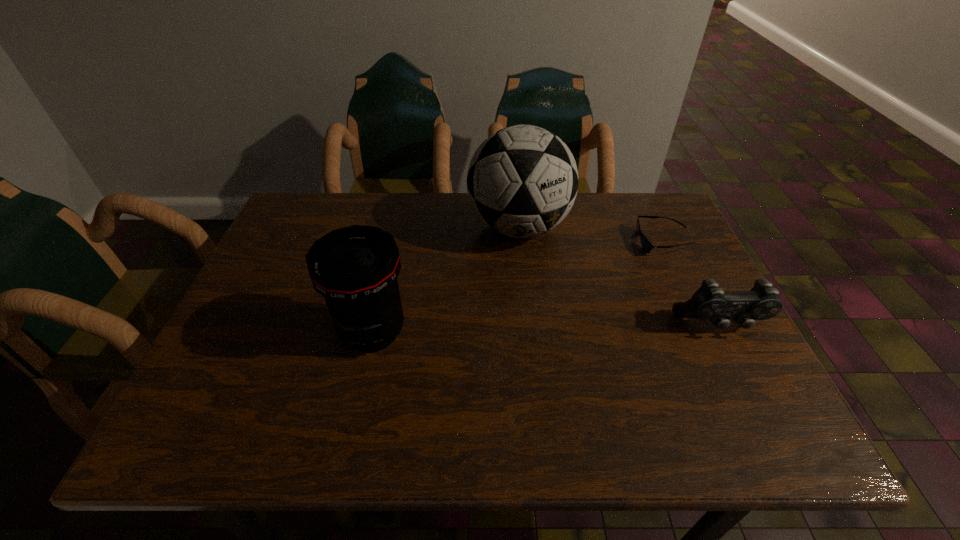
You are a GUI agent. You are given a task and a screenshot of the screen. Output one action in this format:
    pyautogui.click(x=<x>, y=<y>)
    Task: Click on the third shortest object
    The height and width of the screenshot is (540, 960).
    Given the screenshot: What is the action you would take?
    pyautogui.click(x=355, y=268)

The image size is (960, 540). Identify the location of the leftmost object. [355, 268].

Find the location of a particular element. control is located at coordinates (709, 302).

I want to click on the tallest object, so click(522, 181).

Image resolution: width=960 pixels, height=540 pixels. I want to click on soccer ball, so click(x=522, y=181).

This screenshot has width=960, height=540. In order to click on sunglasses in this screenshot , I will do `click(646, 245)`.

Where is `blank area located 0.210m on the back of the telephoto lens`? The height and width of the screenshot is (540, 960). blank area located 0.210m on the back of the telephoto lens is located at coordinates (392, 247).

The width and height of the screenshot is (960, 540). I want to click on free location located on the surface of the second shortest object with buttons, so click(x=746, y=375).

Where is `vacant region located 0.330m on the surface of the third object from right to left where the brand logo is visible`? The image size is (960, 540). vacant region located 0.330m on the surface of the third object from right to left where the brand logo is visible is located at coordinates (514, 364).

This screenshot has width=960, height=540. What are the coordinates of `vacant space located 0.380m on the surface of the third object from right to left where the brand logo is visible` in the screenshot? It's located at (514, 385).